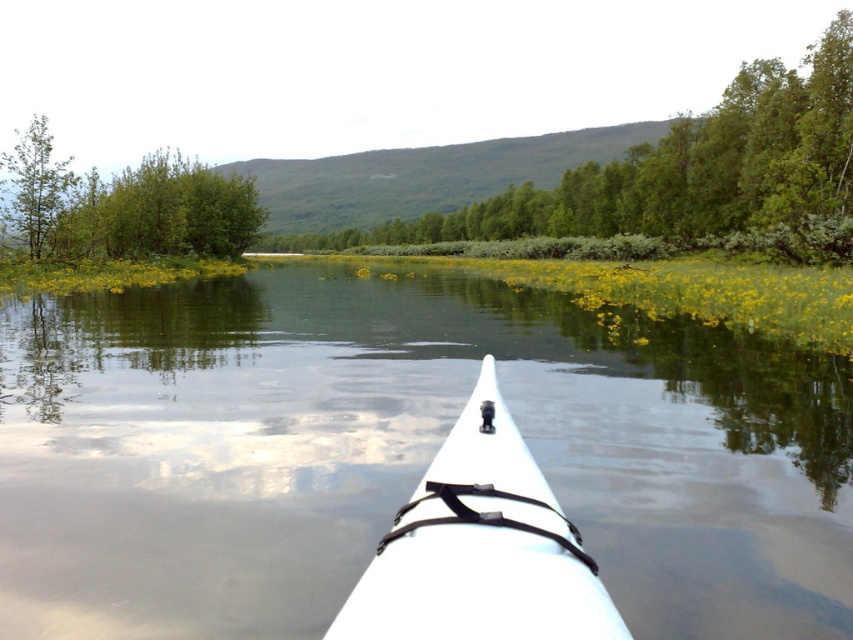
Is clear water at center positioned behind green leafy tree at upper left?

No, clear water at center is in front of green leafy tree at upper left.

Can you confirm if clear water at center is positioned to the left of green leafy tree at upper left?

Incorrect, clear water at center is not on the left side of green leafy tree at upper left.

The height and width of the screenshot is (640, 853). Identify the location of clear water at center. (399, 452).

Where is `clear water at center`? The height and width of the screenshot is (640, 853). clear water at center is located at coordinates (399, 452).

Does green leafy trees at upper center have a greater height compared to green leafy tree at upper left?

Indeed, green leafy trees at upper center has a greater height compared to green leafy tree at upper left.

Who is more forward, (758, 195) or (161, 243)?

Point (758, 195)

Is point (848, 60) behind point (253, 216)?

No, (848, 60) is closer to viewer.

You are a GUI agent. You are given a task and a screenshot of the screen. Output one action in this format:
    pyautogui.click(x=<x>, y=<y>)
    Task: Click on the green leafy trees at upper center
    The image size is (853, 640).
    Given the screenshot: What is the action you would take?
    pyautogui.click(x=679, y=170)

Who is positioned more to the left, white matte kayak at center or green leafy tree at left?

From the viewer's perspective, green leafy tree at left appears more on the left side.

What do you see at coordinates (480, 547) in the screenshot? I see `white matte kayak at center` at bounding box center [480, 547].

This screenshot has width=853, height=640. What are the coordinates of `white matte kayak at center` in the screenshot? It's located at (480, 547).